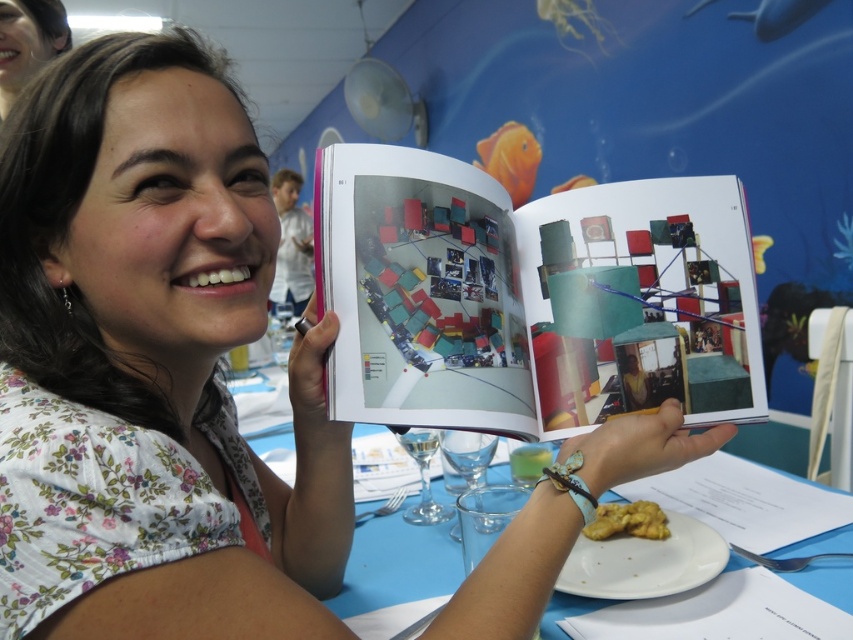
Is golden crumbly pastry at center taller than clear glass wine glass at lower center?

No, golden crumbly pastry at center is not taller than clear glass wine glass at lower center.

Does golden crumbly pastry at center have a greater width compared to clear glass wine glass at lower center?

Yes.

At what (x,y) coordinates should I click in order to perform the action: click on golden crumbly pastry at center. Please return your answer as a coordinate pair (x, y). Looking at the image, I should click on (628, 520).

Based on the photo, does blue plastic table at center have a greater width compared to transparent glass at center?

Indeed, blue plastic table at center has a greater width compared to transparent glass at center.

Can you confirm if blue plastic table at center is positioned above transparent glass at center?

No, blue plastic table at center is not above transparent glass at center.

The height and width of the screenshot is (640, 853). Describe the element at coordinates (396, 564) in the screenshot. I see `blue plastic table at center` at that location.

Identify the location of blue plastic table at center. (396, 564).

Which is more to the left, blue plastic table at center or golden crumbly pastry at center?

blue plastic table at center is more to the left.

Is blue plastic table at center taller than golden crumbly pastry at center?

Correct, blue plastic table at center is much taller as golden crumbly pastry at center.

Is point (451, 579) positioned before point (653, 512)?

Yes, point (451, 579) is closer to viewer.

At what (x,y) coordinates should I click in order to perform the action: click on blue plastic table at center. Please return your answer as a coordinate pair (x, y). Looking at the image, I should click on (396, 564).